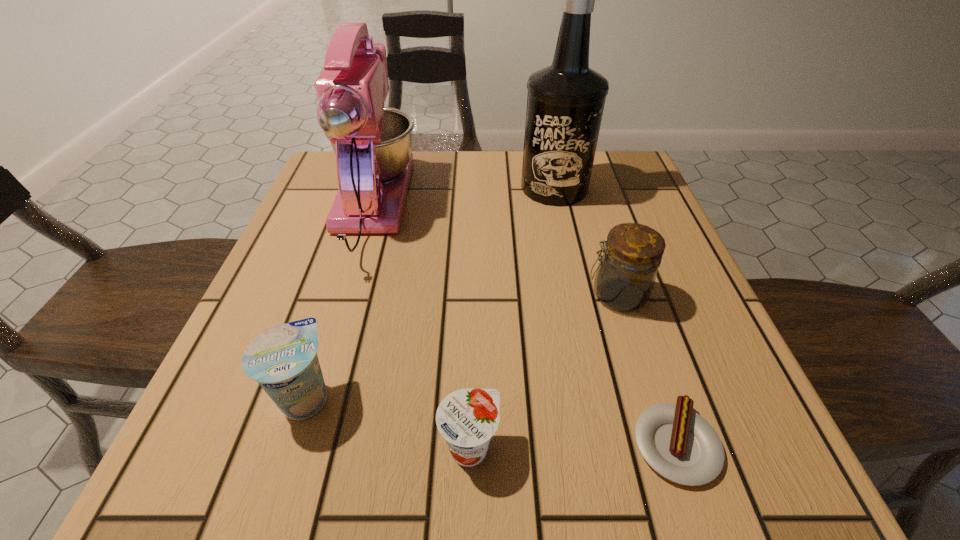
Where is `object identified as the closest to the tallest object`? The width and height of the screenshot is (960, 540). object identified as the closest to the tallest object is located at coordinates (625, 277).

Locate an element on the screen. object that is the fourth closest to the jar is located at coordinates point(372,143).

Where is `free spot that satisfies the following two spatial constraints: 1. on the front side of the third shortest object; 2. on the right side of the sausage`? This screenshot has width=960, height=540. free spot that satisfies the following two spatial constraints: 1. on the front side of the third shortest object; 2. on the right side of the sausage is located at coordinates 291,443.

The image size is (960, 540). What are the coordinates of `vacant area in the image that satisfies the following two spatial constraints: 1. on the lid of the sausage; 2. on the right side of the jar` in the screenshot? It's located at coord(662,443).